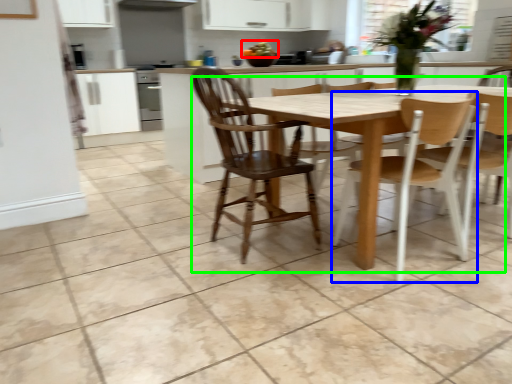
Question: Which object is the farthest from food (highlighted by a red box)? Choose among these: chair (highlighted by a blue box) or kitchen & dining room table (highlighted by a green box).

Choices:
 (A) chair
 (B) kitchen & dining room table

Answer: (A)